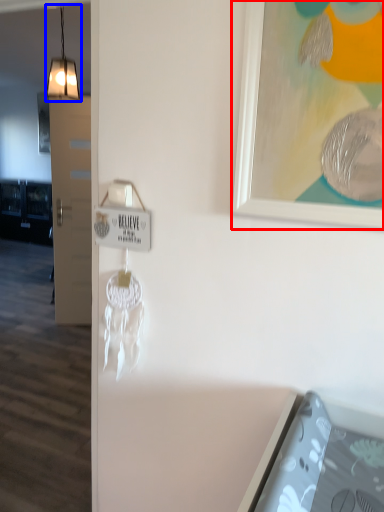
Question: Which object is closer to the camera taking this photo, picture frame (highlighted by a red box) or light (highlighted by a blue box)?

Choices:
 (A) picture frame
 (B) light

Answer: (A)